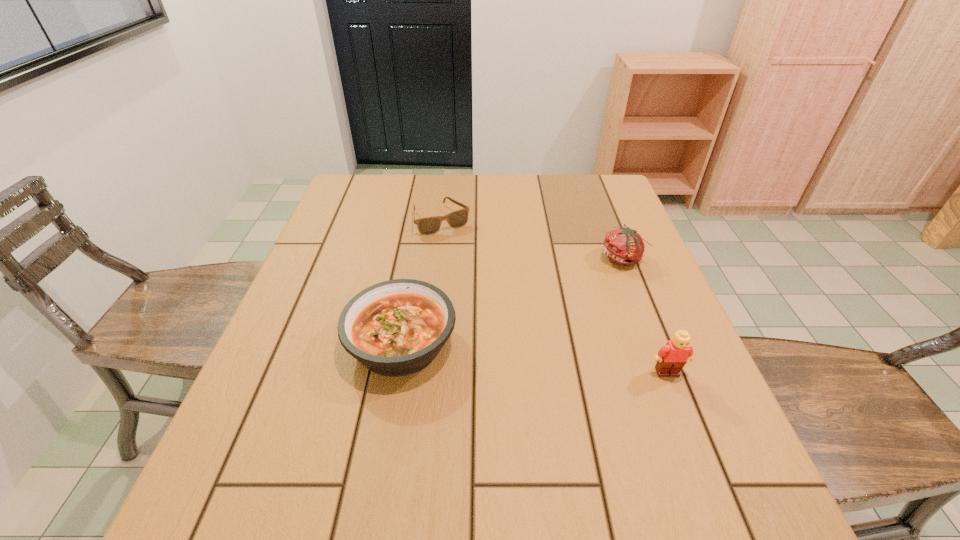
At what (x,y) coordinates should I click in order to perform the action: click on free spot between the tomato and the farthest object. Please return your answer as a coordinate pair (x, y). The width and height of the screenshot is (960, 540). Looking at the image, I should click on (532, 239).

Identify the location of the third closest object relative to the tallest object. The image size is (960, 540). (430, 225).

In order to click on object that is the second closest one to the Lego in this screenshot , I will do `click(394, 328)`.

Locate an element on the screen. The image size is (960, 540). vacant space that satisfies the following two spatial constraints: 1. on the front side of the tomato; 2. on the left side of the sunglasses is located at coordinates (437, 258).

Where is `vacant space that satisfies the following two spatial constraints: 1. on the back side of the farthest object; 2. on the right side of the stew`? This screenshot has height=540, width=960. vacant space that satisfies the following two spatial constraints: 1. on the back side of the farthest object; 2. on the right side of the stew is located at coordinates (423, 220).